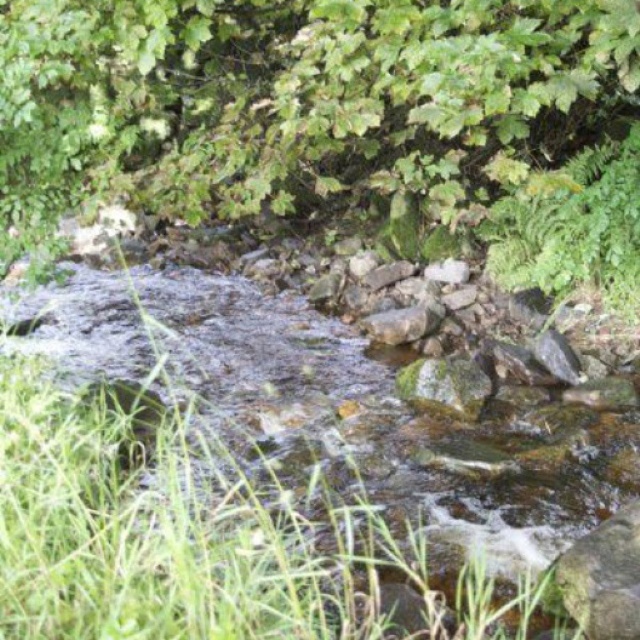
Does point (372, 456) come farther from viewer compared to point (621, 544)?

Yes, point (372, 456) is farther from viewer.

The height and width of the screenshot is (640, 640). Describe the element at coordinates (244, 477) in the screenshot. I see `green grass at center` at that location.

Identify the location of green grass at center. (244, 477).

Where is `green grass at center`? This screenshot has width=640, height=640. green grass at center is located at coordinates (244, 477).